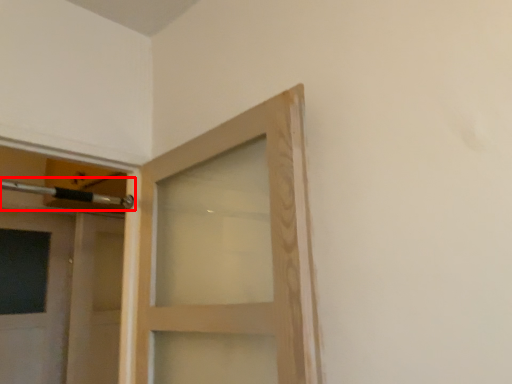
Question: Observing the image, what is the correct spatial positioning of door handle (annotated by the red box) in reference to door?

Choices:
 (A) left
 (B) right

Answer: (B)